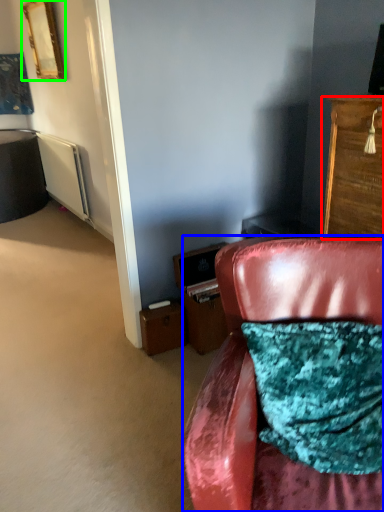
Question: Based on their relative distances, which object is farther from cabinetry (highlighted by a red box)? Choose from chair (highlighted by a blue box) and picture frame (highlighted by a green box).

Choices:
 (A) chair
 (B) picture frame

Answer: (B)